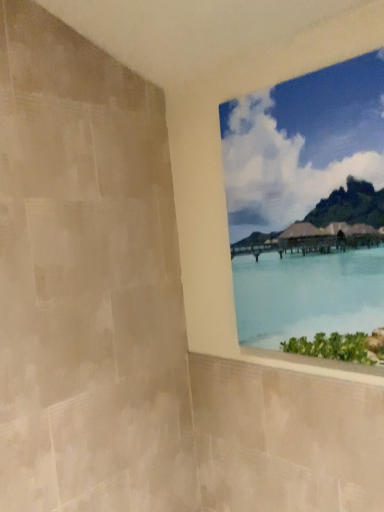
This screenshot has height=512, width=384. Describe the element at coordinates (302, 143) in the screenshot. I see `watercolor painting of tropical scene at upper right` at that location.

You are a GUI agent. You are given a task and a screenshot of the screen. Output one action in this format:
    pyautogui.click(x=<x>, y=<y>)
    Task: Click on the watercolor painting of tropical scene at upper right
    The image size is (384, 512).
    Given the screenshot: What is the action you would take?
    pyautogui.click(x=302, y=143)

Identify the location of watercolor painting of tropical scene at upper right. This screenshot has height=512, width=384. (302, 143).